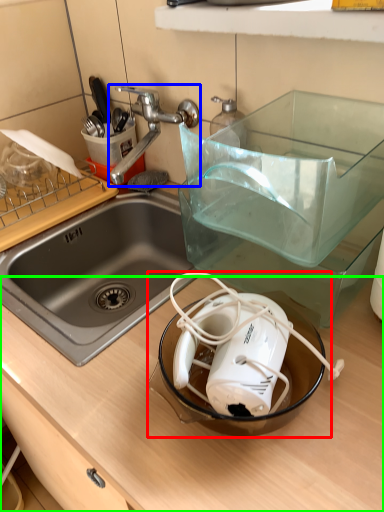
Question: Based on their relative distances, which object is nearer to appliance (highlighted by a red box)? Choose from tap (highlighted by a blue box) and counter top (highlighted by a green box).

Choices:
 (A) tap
 (B) counter top

Answer: (B)